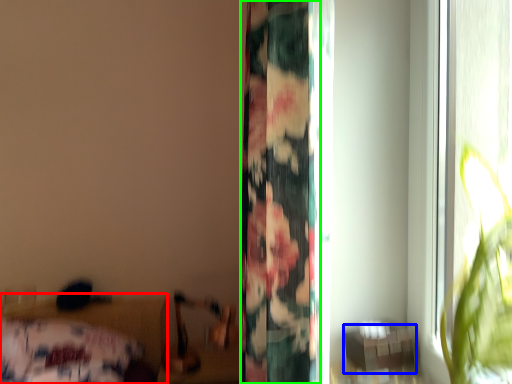
Question: Which object is the closest to the bed (highlighted by a red box)? Choose among these: table (highlighted by a blue box) or curtain (highlighted by a green box).

Choices:
 (A) table
 (B) curtain

Answer: (B)